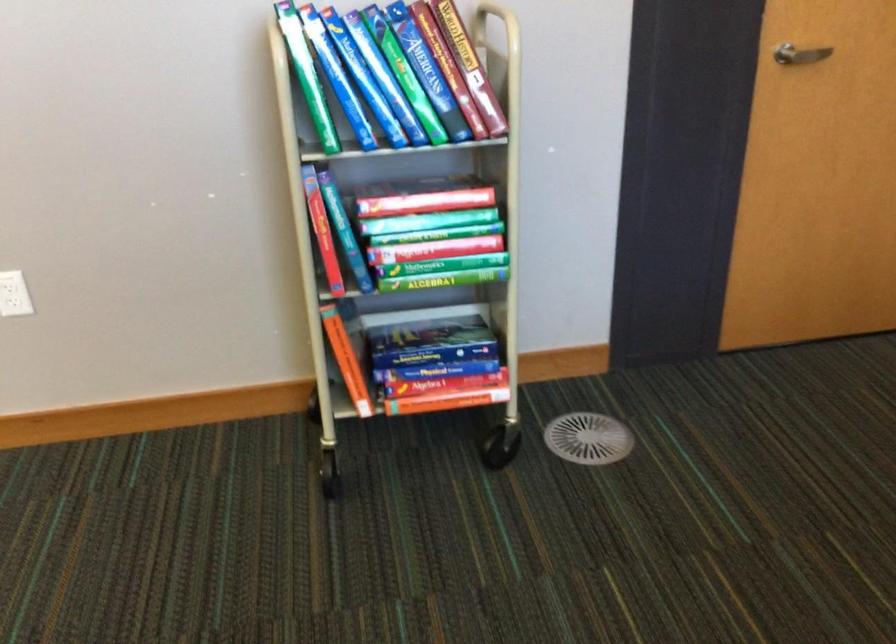
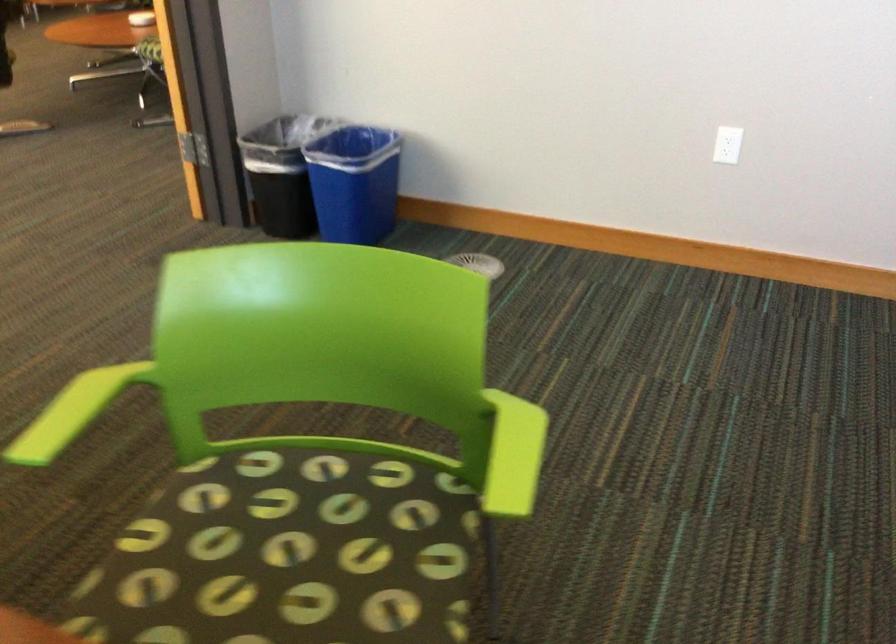
Question: The camera is either moving clockwise (left) or counter-clockwise (right) around the object. The first image is from the beginning of the video and the second image is from the end. Is the camera moving left or right when shooting the video?

Choices:
 (A) Left
 (B) Right

Answer: (B)